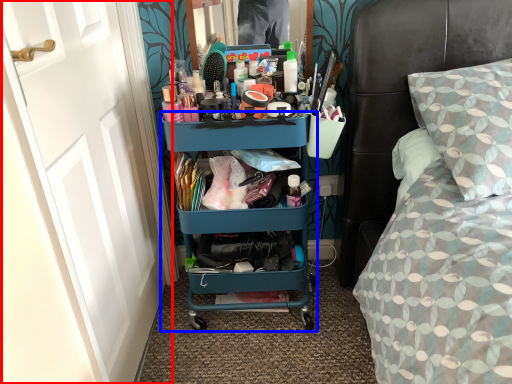
Question: Which of the following is the closest to the observer, door (highlighted by a red box) or shelf (highlighted by a blue box)?

Choices:
 (A) door
 (B) shelf

Answer: (A)